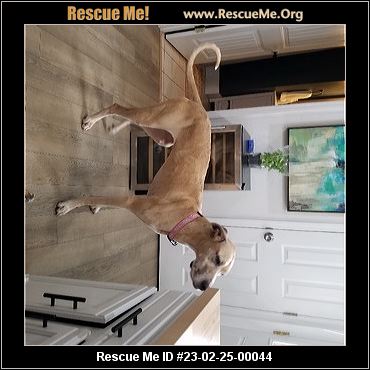
Find the location of a particular element. This screenshot has height=370, width=370. abstract painting is located at coordinates (319, 177).